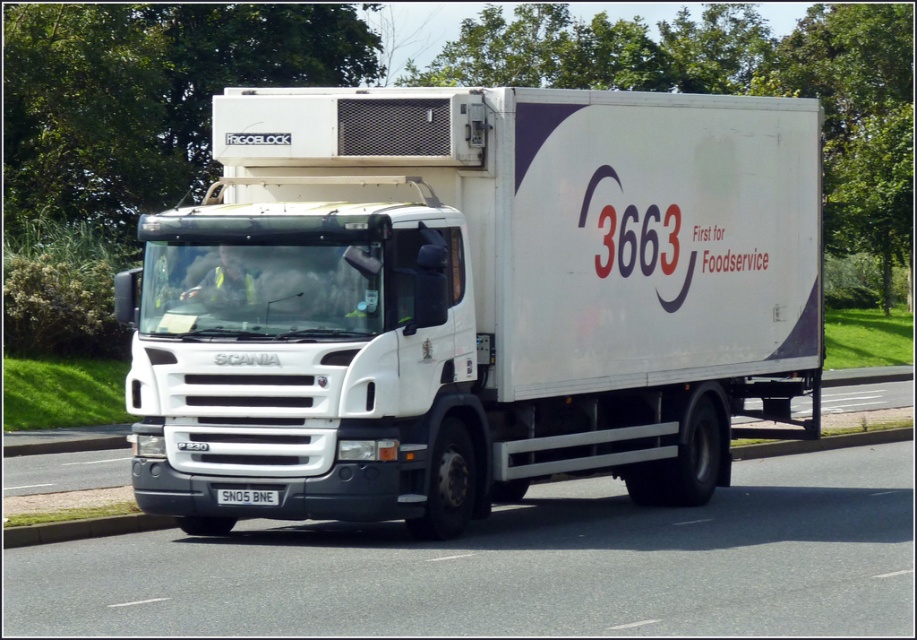
Question: Does white matte truck at center have a larger size compared to white metallic license plate at center?

Choices:
 (A) yes
 (B) no

Answer: (B)

Question: Does white matte truck at center have a lesser width compared to white metallic license plate at center?

Choices:
 (A) yes
 (B) no

Answer: (A)

Question: Which point is farther from the camera taking this photo?

Choices:
 (A) (218, 492)
 (B) (499, 132)

Answer: (B)

Question: From the image, what is the correct spatial relationship of white matte truck at center in relation to white metallic license plate at center?

Choices:
 (A) below
 (B) above

Answer: (A)